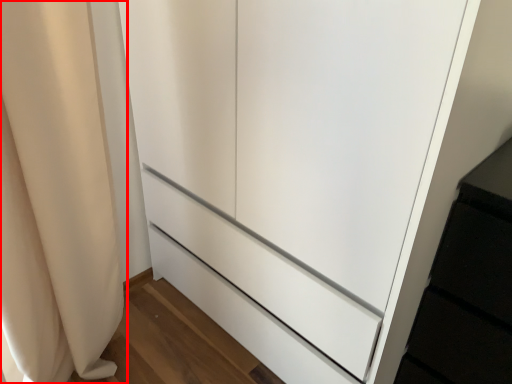
Question: From the image's perspective, considering the relative positions of curtain (annotated by the red box) and cupboard in the image provided, where is curtain (annotated by the red box) located with respect to the staircase?

Choices:
 (A) below
 (B) above

Answer: (A)